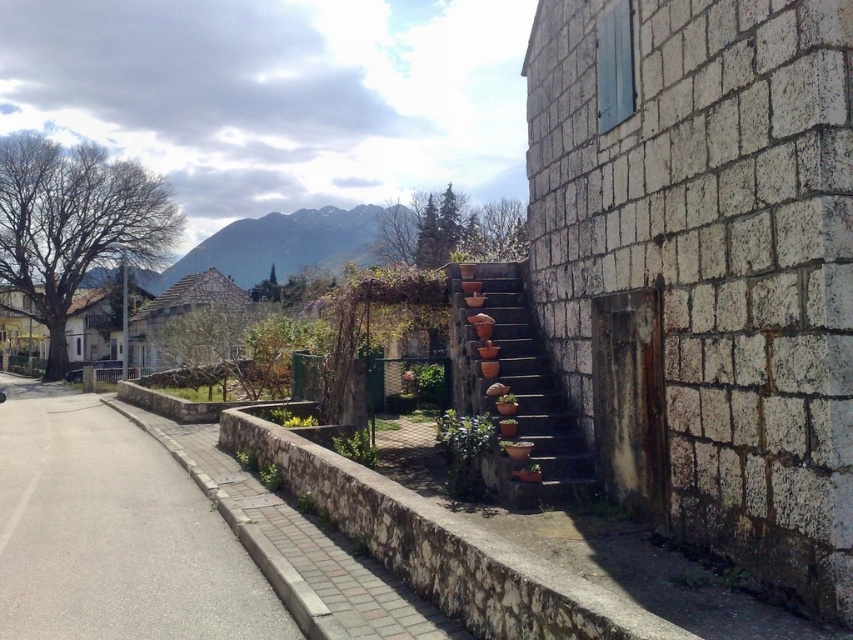
Who is more distant from viewer, (735, 184) or (454, 332)?

The point (454, 332) is more distant.

Describe the element at coordinates (704, 266) in the screenshot. Image resolution: width=853 pixels, height=640 pixels. I see `white stone wall at right` at that location.

At what (x,y) coordinates should I click in order to perform the action: click on white stone wall at right. Please return your answer as a coordinate pair (x, y). This screenshot has width=853, height=640. Looking at the image, I should click on (704, 266).

What do you see at coordinates (113, 532) in the screenshot? I see `gray asphalt pavement at lower left` at bounding box center [113, 532].

Looking at this image, does gray asphalt pavement at lower left have a larger size compared to terracotta clay pots at center?

Indeed, gray asphalt pavement at lower left has a larger size compared to terracotta clay pots at center.

Where is `gray asphalt pavement at lower left`? The image size is (853, 640). gray asphalt pavement at lower left is located at coordinates (113, 532).

Which is above, white stone wall at right or gray asphalt pavement at lower left?

Positioned higher is white stone wall at right.

The height and width of the screenshot is (640, 853). Describe the element at coordinates (704, 266) in the screenshot. I see `white stone wall at right` at that location.

At what (x,y) coordinates should I click in order to perform the action: click on white stone wall at right. Please return your answer as a coordinate pair (x, y). The width and height of the screenshot is (853, 640). Looking at the image, I should click on (704, 266).